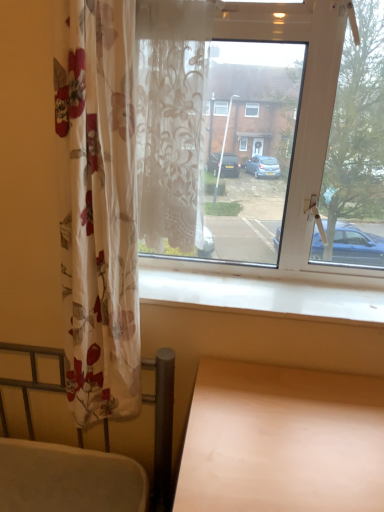
Question: Is translucent floral curtain at center not within transparent glass window at center?

Choices:
 (A) yes
 (B) no

Answer: (B)

Question: Is translucent floral curtain at center further to camera compared to transparent glass window at center?

Choices:
 (A) yes
 (B) no

Answer: (B)

Question: Does translucent floral curtain at center have a lesser height compared to transparent glass window at center?

Choices:
 (A) no
 (B) yes

Answer: (B)

Question: Is transparent glass window at center inside translucent floral curtain at center?

Choices:
 (A) no
 (B) yes

Answer: (A)

Question: Does translucent floral curtain at center appear on the left side of transparent glass window at center?

Choices:
 (A) yes
 (B) no

Answer: (A)

Question: Does translucent floral curtain at center have a larger size compared to transparent glass window at center?

Choices:
 (A) no
 (B) yes

Answer: (A)

Question: Is translucent floral curtain at center shorter than light wood table at lower right?

Choices:
 (A) yes
 (B) no

Answer: (B)

Question: Is translucent floral curtain at center next to light wood table at lower right and touching it?

Choices:
 (A) yes
 (B) no

Answer: (B)

Question: Is translucent floral curtain at center taller than light wood table at lower right?

Choices:
 (A) no
 (B) yes

Answer: (B)

Question: Is translucent floral curtain at center at the right side of light wood table at lower right?

Choices:
 (A) no
 (B) yes

Answer: (A)

Question: Is translucent floral curtain at center smaller than light wood table at lower right?

Choices:
 (A) yes
 (B) no

Answer: (A)

Question: Considering the relative sizes of translucent floral curtain at center and light wood table at lower right in the image provided, is translucent floral curtain at center thinner than light wood table at lower right?

Choices:
 (A) yes
 (B) no

Answer: (A)

Question: From the image's perspective, does transparent glass window at center appear lower than light wood table at lower right?

Choices:
 (A) no
 (B) yes

Answer: (A)